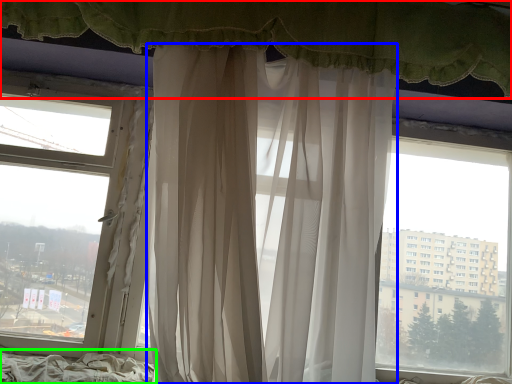
Question: Which object is positioned farthest from curtain (highlighted by a red box)? Select from curtain (highlighted by a blue box) and bed frame (highlighted by a green box).

Choices:
 (A) curtain
 (B) bed frame

Answer: (B)